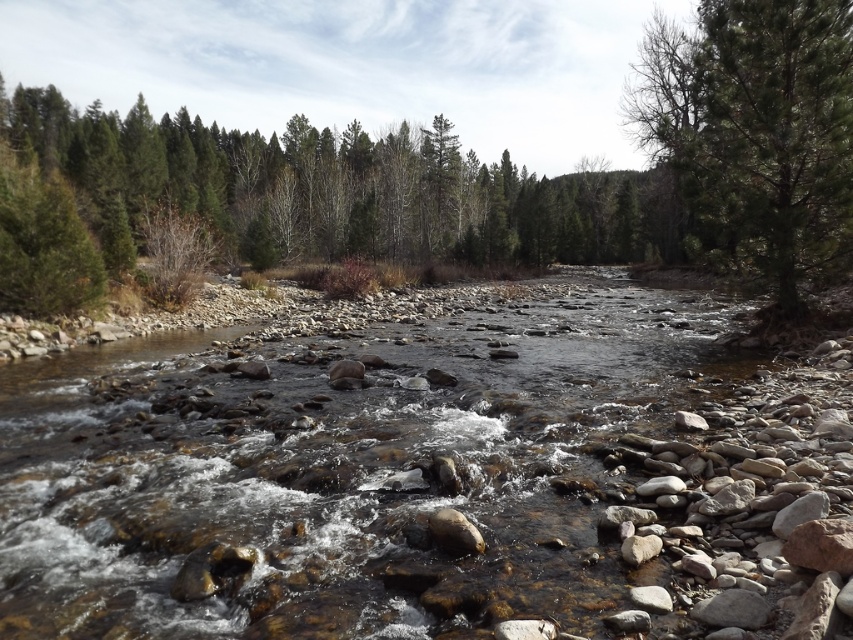
You are a hiker trying to cross the river using the smooth rock stream at center. There is a green textured tree at upper right nearby. Which direction should you look to see the tree while standing on the rocks?

The smooth rock stream at center is positioned under the green textured tree at upper right, so when standing on the rocks, you should look upward toward the upper right direction to see the tree.

Consider the image. You are standing at the edge of the river and notice a point marked at coordinates (343, 468). Based on the scene description, what feature does this point most likely represent?

The point at (343, 468) corresponds to the smooth rock stream at center, as described in the scene.

You are standing at the edge of the river and see two points marked in the image. The first point is at coordinate point (x=102, y=508) and the second is at point (x=810, y=68). Which point is closer to your current position?

Point (x=102, y=508) is closer to the camera than point (x=810, y=68), so the first point is closer to your current position.